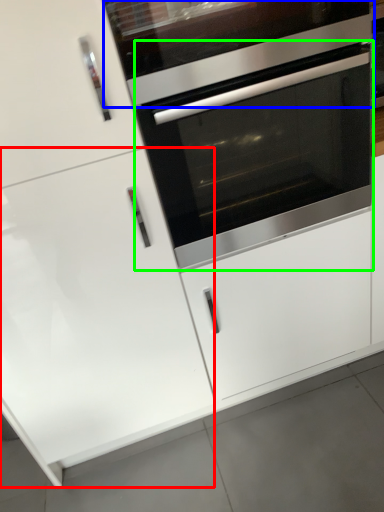
Question: Which object is positioned farthest from door (highlighted by a red box)? Select from vent (highlighted by a blue box) and oven (highlighted by a green box).

Choices:
 (A) vent
 (B) oven

Answer: (A)